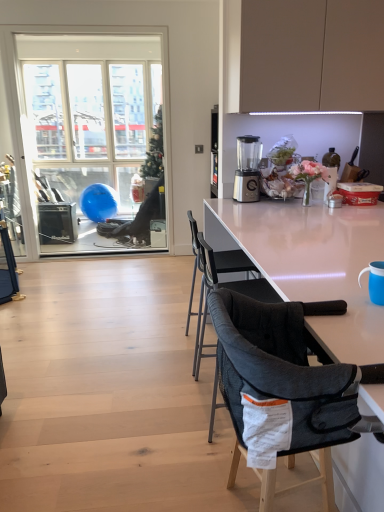
I want to click on vacant space that is to the left of dark gray fabric chair at center, the first chair from the back, so click(145, 349).